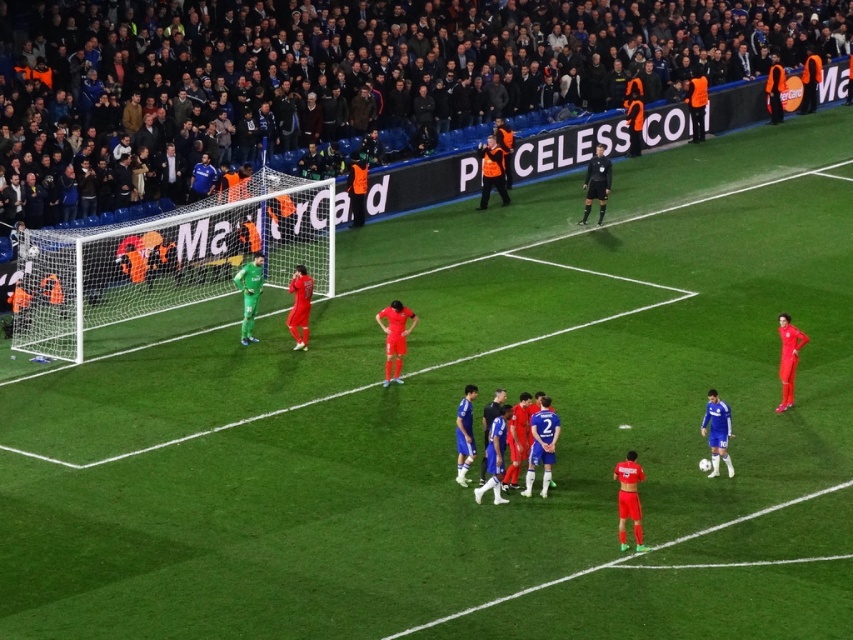
You are a soccer player positioned at the center of the field and need to pass the ball to your teammate wearing the black jersey at center. However, there is a dark gray fabric crowd at upper center blocking your view. Can you still make the pass without the ball going through the crowd?

The dark gray fabric crowd at upper center and black jersey at center are 7.00 meters apart. Since the crowd is 7 meters away from the black jersey, the ball can be passed directly to the teammate without going through the crowd as they are separated by that distance.

You are a soccer player wearing a black jersey at center. You want to kick the ball into the green net at left. Based on your current position, which direction should you aim to score a goal?

The green net at left is located below the black jersey at center, so you should aim downward to score a goal.

You are a photographer standing at the edge of the soccer field. You want to take a photo of the dark gray fabric crowd at upper center. If your camera has a maximum focus range of 20 meters, will you be able to capture the crowd clearly?

The dark gray fabric crowd at upper center and the viewer are 22.52 meters apart. Since the camera can only focus up to 20 meters, it won not be able to capture the crowd clearly.